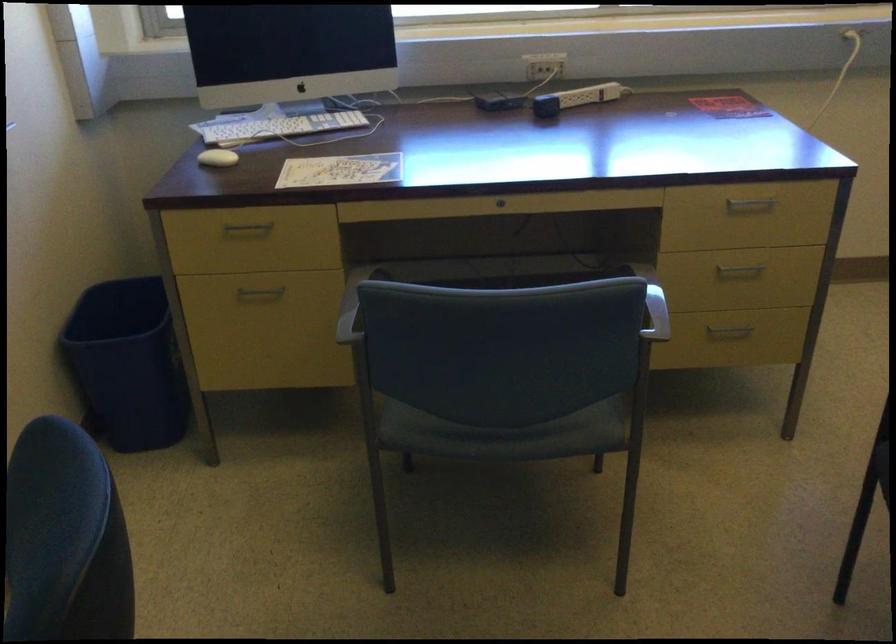
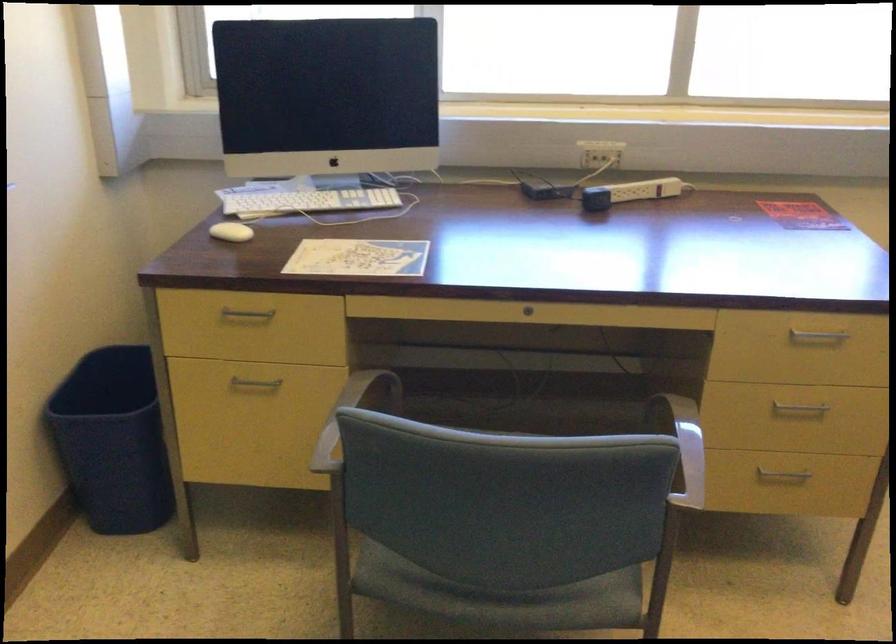
The point at (x=586, y=93) is marked in the first image. Where is the corresponding point in the second image?

(642, 190)